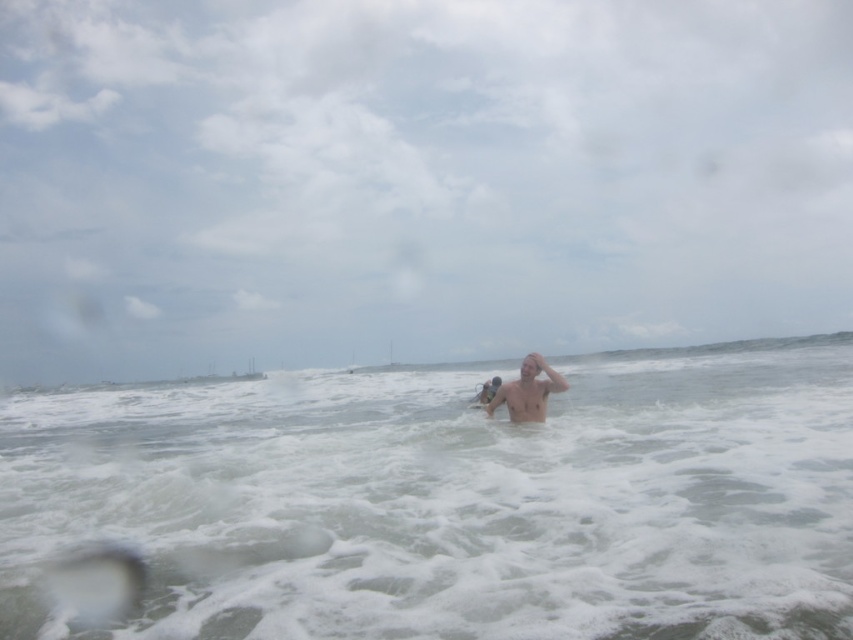
Describe the element at coordinates (453, 500) in the screenshot. I see `white foamy water at center` at that location.

Does white foamy water at center have a lesser height compared to shiny skin head at center?

In fact, white foamy water at center may be taller than shiny skin head at center.

Which is in front, point (276, 611) or point (503, 401)?

Point (276, 611) is more forward.

Find the location of a particular element. The image size is (853, 640). white foamy water at center is located at coordinates (453, 500).